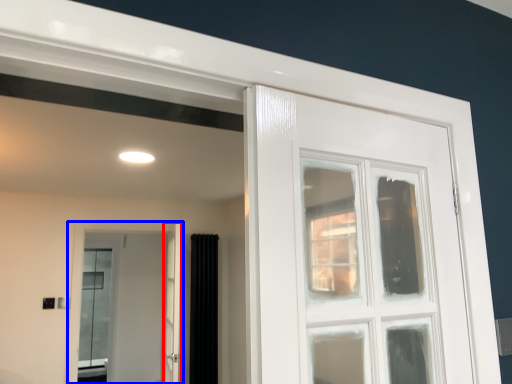
Question: Which object appears farthest to the camera in this image, screen door (highlighted by a red box) or door (highlighted by a blue box)?

Choices:
 (A) screen door
 (B) door

Answer: (B)